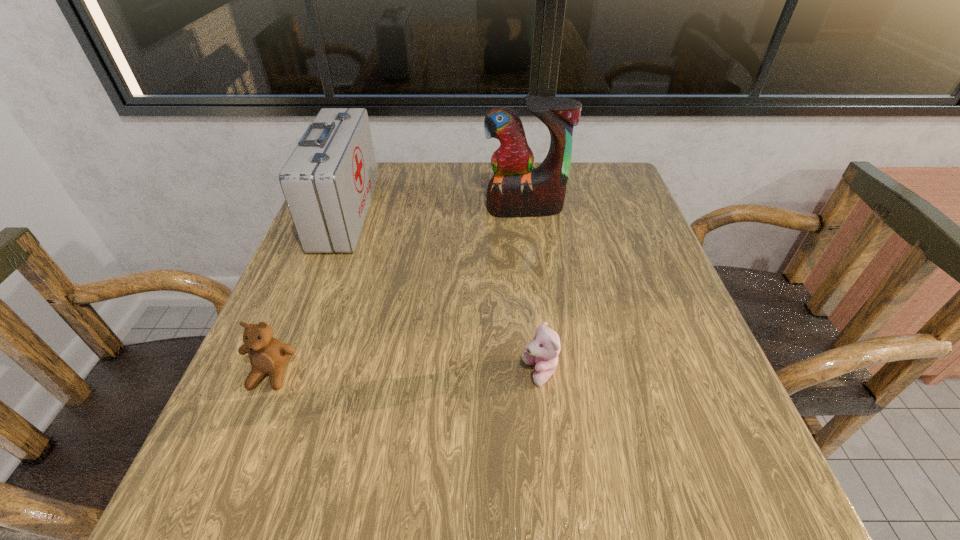
In order to click on parrot that is at the far edge in this screenshot , I will do `click(516, 190)`.

The image size is (960, 540). I want to click on the first-aid kit situated at the far edge, so click(328, 182).

Identify the location of the first-aid kit located in the left edge section of the desktop. The height and width of the screenshot is (540, 960). (328, 182).

Where is `teddy bear present at the left edge`? The height and width of the screenshot is (540, 960). teddy bear present at the left edge is located at coordinates (268, 355).

You are a GUI agent. You are given a task and a screenshot of the screen. Output one action in this format:
    pyautogui.click(x=<x>, y=<y>)
    Task: Click on the object that is at the far left corner
    Image resolution: width=960 pixels, height=540 pixels.
    Given the screenshot: What is the action you would take?
    pyautogui.click(x=328, y=182)

Identify the location of vacant area at the far edge. pos(410,177).

Find the location of a particular element. This screenshot has width=960, height=540. vacant area at the near edge of the desktop is located at coordinates (415, 496).

Identify the location of vacant position at the left edge of the desktop. The image size is (960, 540). (325, 306).

Image resolution: width=960 pixels, height=540 pixels. I want to click on free space at the right edge of the desktop, so click(614, 236).

Locate an element on the screen. vacant space at the far left corner of the desktop is located at coordinates (389, 170).